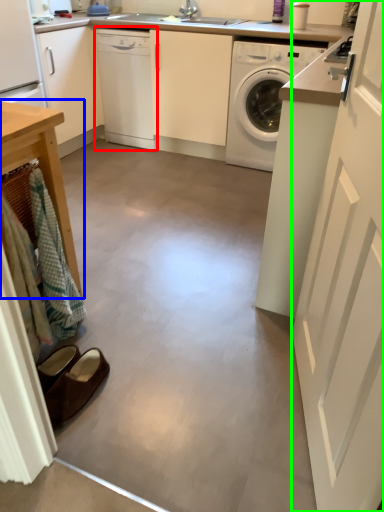
Question: Which object is positioned farthest from dishwasher (highlighted by a red box)? Select from table (highlighted by a blue box) and screen door (highlighted by a green box).

Choices:
 (A) table
 (B) screen door

Answer: (B)